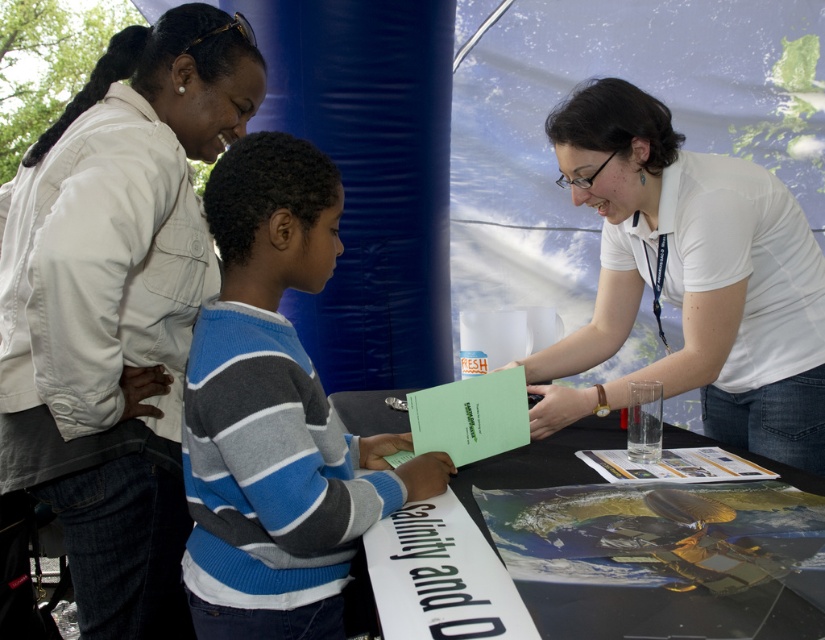
Does white cotton jacket at upper left appear over black paper at lower center?

Correct, white cotton jacket at upper left is located above black paper at lower center.

Which is behind, point (121, 429) or point (463, 616)?

Point (121, 429)

Between point (132, 244) and point (396, 604), which one is positioned behind?

Point (132, 244)

Find the location of a particular element. The width and height of the screenshot is (825, 640). white cotton jacket at upper left is located at coordinates (116, 307).

Is white matte shirt at center thinner than black plastic table at center?

In fact, white matte shirt at center might be wider than black plastic table at center.

Is point (582, 401) closer to camera compared to point (776, 467)?

No, (582, 401) is behind (776, 467).

Find the location of a particular element. The height and width of the screenshot is (640, 825). white matte shirt at center is located at coordinates [691, 278].

Is white matte shirt at center in front of black paper at lower center?

No, it is behind black paper at lower center.

Between white matte shirt at center and black paper at lower center, which one appears on the left side from the viewer's perspective?

Positioned to the left is black paper at lower center.

The width and height of the screenshot is (825, 640). Find the location of `white matte shirt at center`. white matte shirt at center is located at coordinates (691, 278).

At what (x,y) coordinates should I click in order to perform the action: click on white matte shirt at center. Please return your answer as a coordinate pair (x, y). The width and height of the screenshot is (825, 640). Looking at the image, I should click on (691, 278).